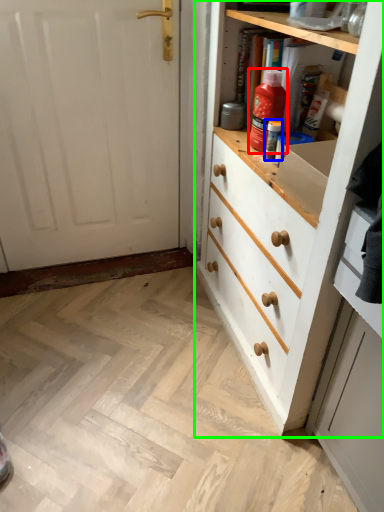
Question: Based on their relative distances, which object is farther from cleaning product (highlighted by a red box)? Choose from bottle (highlighted by a blue box) and chest of drawers (highlighted by a green box).

Choices:
 (A) bottle
 (B) chest of drawers

Answer: (B)